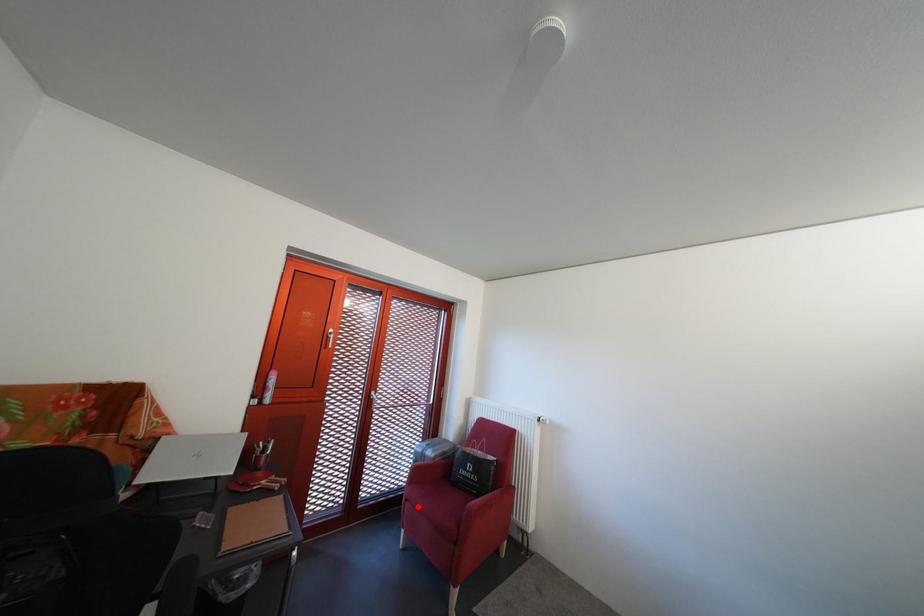
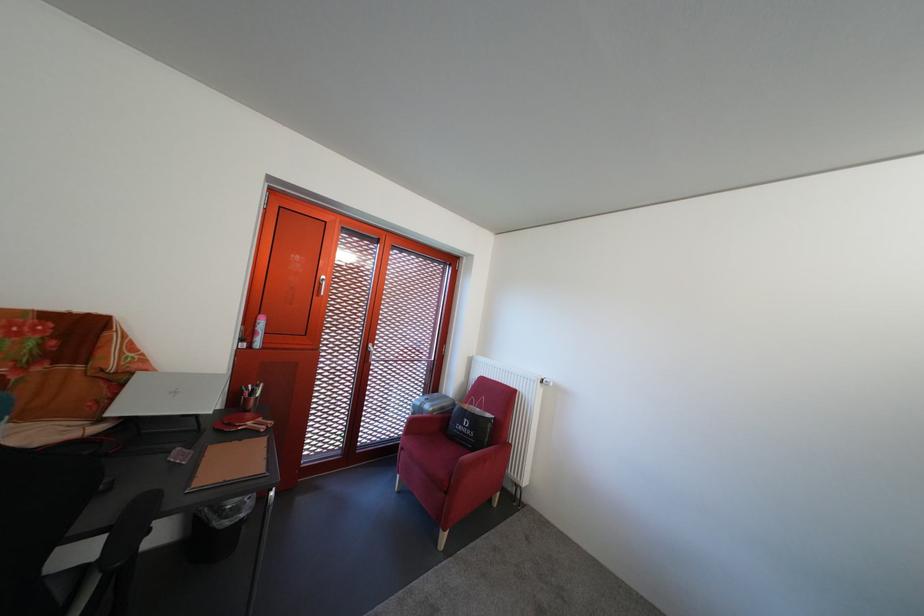
Question: I am providing you with two images of the same scene from different viewpoints. A red point is marked on the first image. At the location where the point appears in image 1, is it still visible in image 2?

Choices:
 (A) Yes
 (B) No

Answer: (A)